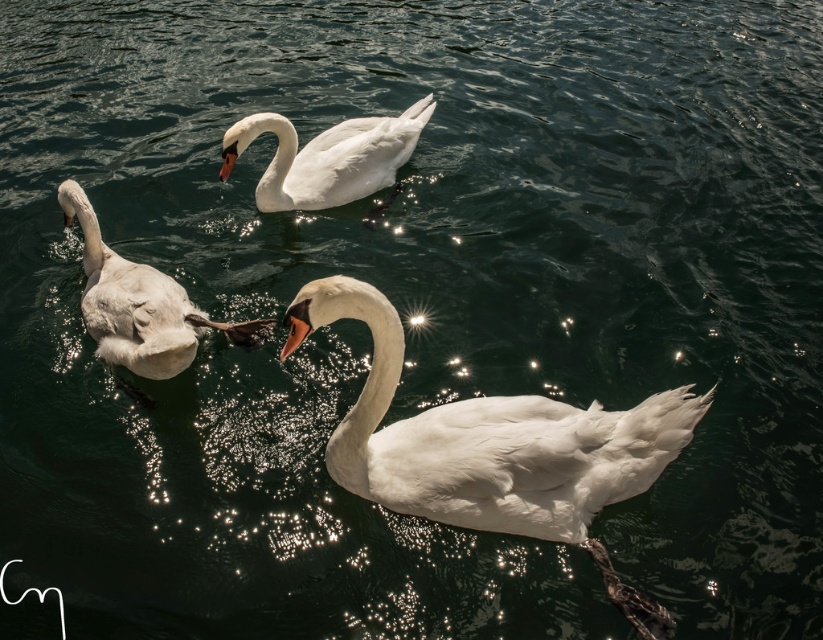
Can you confirm if white feathered swan at center is thinner than white feathered swan at left?

No.

Can you confirm if white feathered swan at center is positioned to the right of white feathered swan at left?

A: Indeed, white feathered swan at center is positioned on the right side of white feathered swan at left.

Is point (466, 435) behind point (245, 321)?

That is False.

At what (x,y) coordinates should I click in order to perform the action: click on white feathered swan at center. Please return your answer as a coordinate pair (x, y). Looking at the image, I should click on (486, 438).

Which is below, white feathered swan at left or white glossy swan at center?

white feathered swan at left is below.

Can you confirm if white feathered swan at left is thinner than white glossy swan at center?

Indeed, white feathered swan at left has a lesser width compared to white glossy swan at center.

What do you see at coordinates (140, 305) in the screenshot? I see `white feathered swan at left` at bounding box center [140, 305].

The height and width of the screenshot is (640, 823). I want to click on white feathered swan at left, so click(x=140, y=305).

Which is below, white feathered swan at center or white glossy swan at center?

Positioned lower is white feathered swan at center.

Identify the location of white feathered swan at center. Image resolution: width=823 pixels, height=640 pixels. (486, 438).